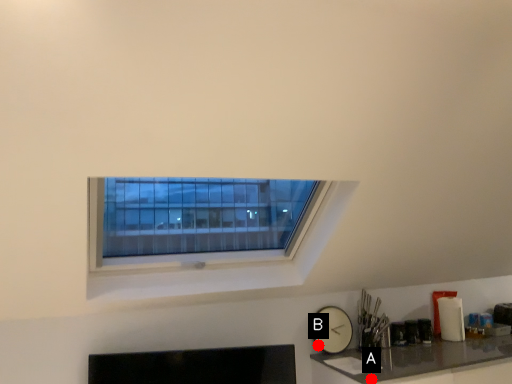
Question: Two points are circled on the image, labeled by A and B beside each circle. Which point is closer to the camera taking this photo?

Choices:
 (A) A is closer
 (B) B is closer

Answer: (A)